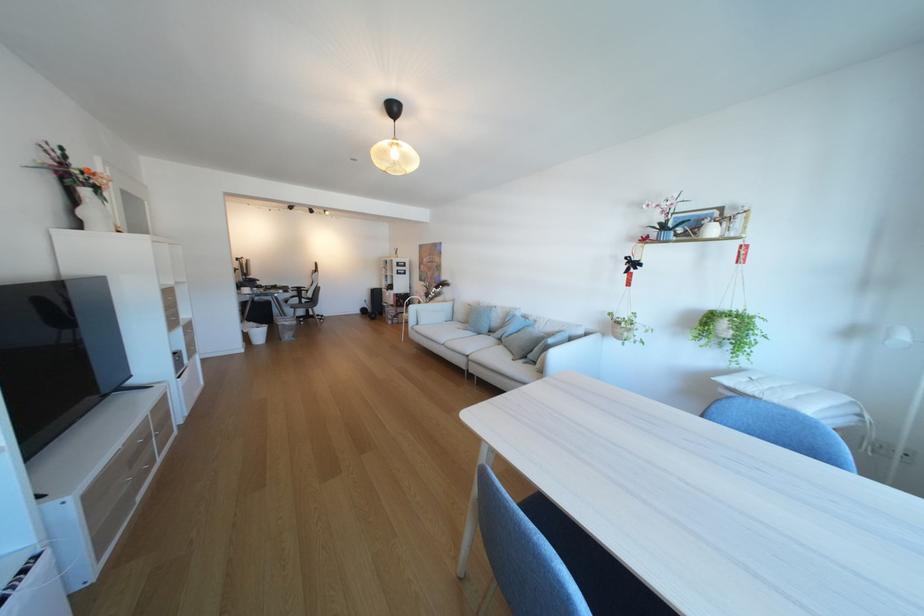
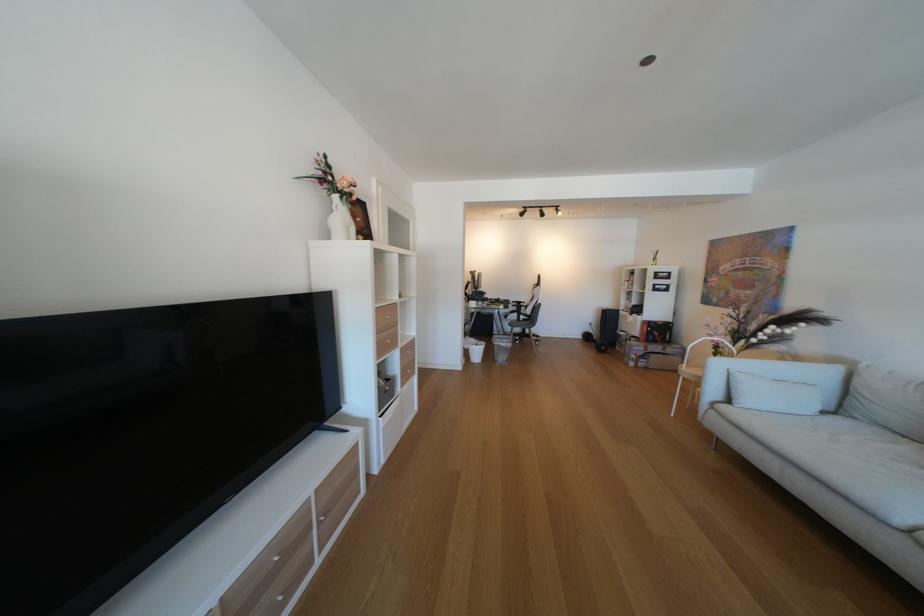
The point at (292, 329) is marked in the first image. Where is the corresponding point in the second image?

(506, 349)